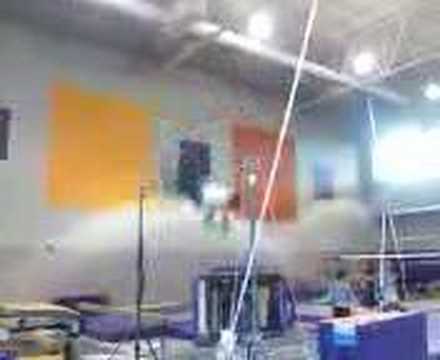
At what (x,y) coordinates should I click in order to perform the action: click on red wall covering. Please return your answer as a coordinate pair (x, y). The image size is (440, 360). Looking at the image, I should click on (251, 141).